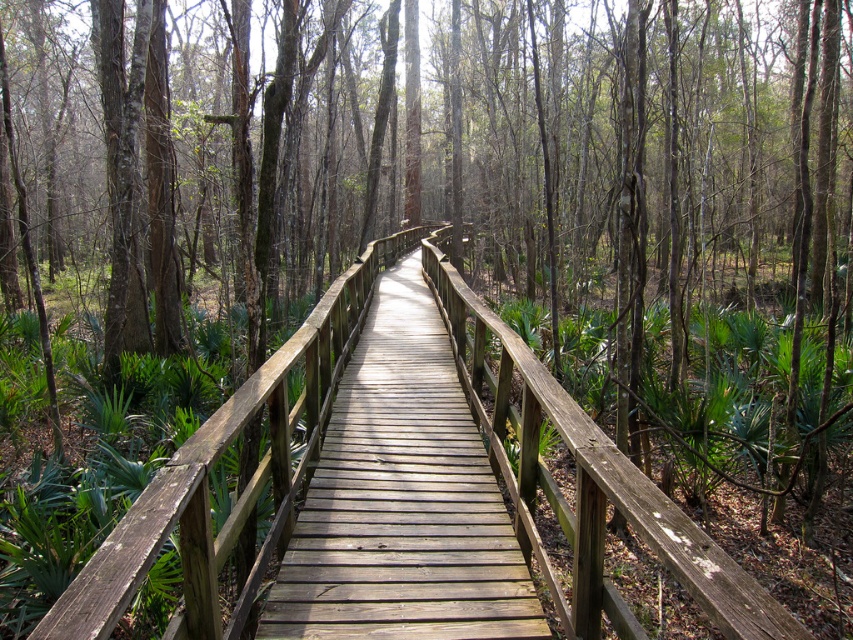
Is natural wood bridge at center to the right of light brown wooden bridge at center from the viewer's perspective?

Incorrect, natural wood bridge at center is not on the right side of light brown wooden bridge at center.

Does point (596, 493) come closer to viewer compared to point (459, 429)?

Yes, it is.

You are a GUI agent. You are given a task and a screenshot of the screen. Output one action in this format:
    pyautogui.click(x=<x>, y=<y>)
    Task: Click on the natural wood bridge at center
    The width and height of the screenshot is (853, 640).
    Given the screenshot: What is the action you would take?
    479,465